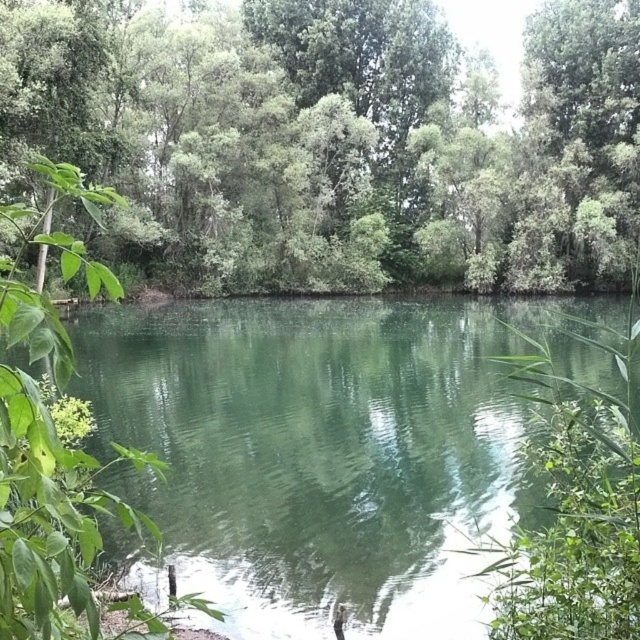
You are standing at the edge of the pond and see two points marked on the water surface. The first point is at coordinates point (577, 212) and the second is at point (198, 563). Which point is closer to you?

Point (577, 212) is further to the viewer than point (198, 563), so the closer point to you is point (198, 563).

You are standing on the edge of the pond and see the green leafy tree at center and the green smooth water at center. Which object is taller?

The green leafy tree at center is taller than the green smooth water at center.

You are standing on the shore of the pond and want to know which object in the scene is wider. Which one is wider between the green leafy tree at center and the green smooth water at center?

The green leafy tree at center is wider than the green smooth water at center according to the description.